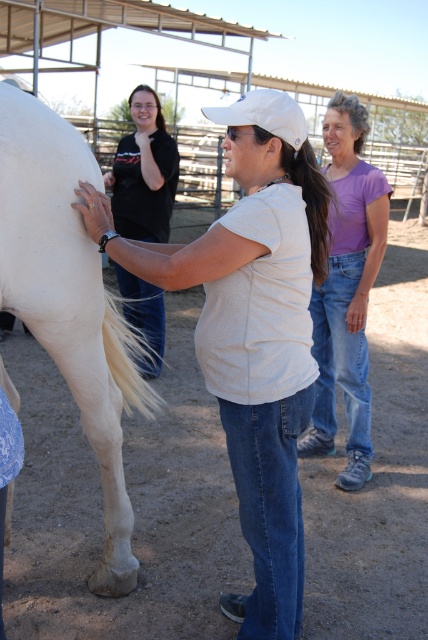
You are a photographer trying to capture a photo of the white matte shirt at center and the white matte horse at left. Which object should you focus on first if you want to ensure both are in sharp focus, considering their sizes?

The white matte shirt at center is smaller than the white matte horse at left, so you should focus on the white matte horse at left first to ensure both are in sharp focus.

You are a photographer planning to take a group photo of the people in the scene. The camera frame can only accommodate the width of the black matte shirt at upper left. Will the purple cotton shirt at center fit within the same frame?

The purple cotton shirt at center has a larger width than the black matte shirt at upper left. Since the camera frame can only accommodate the width of the black matte shirt at upper left, the purple cotton shirt at center will not fit within the same frame.